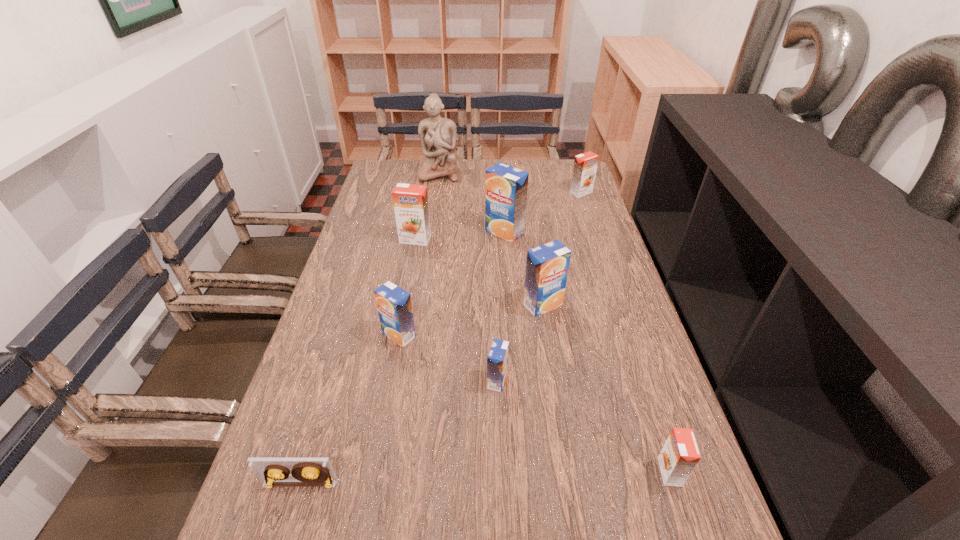
This screenshot has height=540, width=960. What are the coordinates of `the second smallest blue orange_juice` in the screenshot? It's located at (394, 306).

Locate an element on the screen. This screenshot has height=540, width=960. the third farthest blue orange_juice is located at coordinates (394, 306).

Identify the location of the sixth farthest orange juice. The width and height of the screenshot is (960, 540). (497, 361).

This screenshot has width=960, height=540. What are the coordinates of `the seventh farthest object` in the screenshot? It's located at (497, 361).

Find the location of a particular element. the nearest orange orange juice is located at coordinates (679, 456).

The image size is (960, 540). I want to click on the smallest orange orange juice, so click(x=679, y=456).

At what (x,y) coordinates should I click in order to perform the action: click on the shortest object. Please return your answer as a coordinate pair (x, y). The height and width of the screenshot is (540, 960). Looking at the image, I should click on (271, 472).

The width and height of the screenshot is (960, 540). What are the coordinates of `brown videotape` in the screenshot? It's located at (271, 472).

Image resolution: width=960 pixels, height=540 pixels. What are the coordinates of `vacant region located 0.240m on the front-facing side of the farthest object` in the screenshot? It's located at (432, 219).

Find the location of a particular element. The image size is (960, 540). free space located 0.250m on the front of the second tallest object is located at coordinates (510, 299).